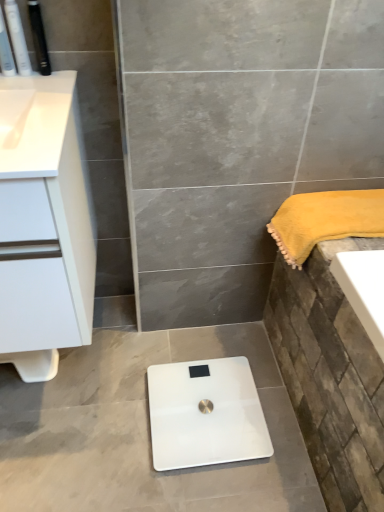
Where is `vacant area on top of yellow plush towel at right (from a real-world perspective)`? vacant area on top of yellow plush towel at right (from a real-world perspective) is located at coordinates (347, 205).